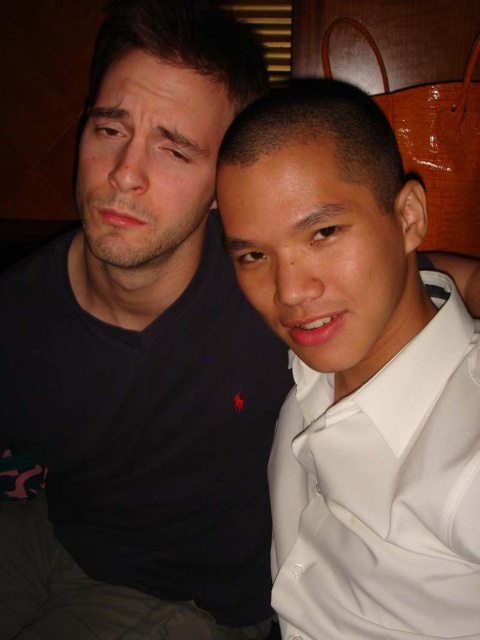
Question: Is black matte shirt at left in front of white satin dress shirt at right?

Choices:
 (A) yes
 (B) no

Answer: (B)

Question: Can you confirm if black matte shirt at left is positioned above white satin dress shirt at right?

Choices:
 (A) yes
 (B) no

Answer: (A)

Question: Which point is farther to the camera?

Choices:
 (A) black matte shirt at left
 (B) white satin dress shirt at right

Answer: (A)

Question: Which object is farther from the camera taking this photo?

Choices:
 (A) white satin dress shirt at right
 (B) black matte shirt at left

Answer: (B)

Question: Is black matte shirt at left closer to camera compared to white satin dress shirt at right?

Choices:
 (A) no
 (B) yes

Answer: (A)